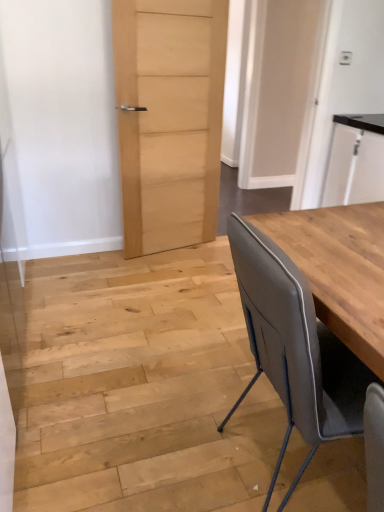
Locate an element on the screen. Image resolution: width=384 pixels, height=512 pixels. natural wood door at center, which is counted as the second door, starting from the right is located at coordinates (169, 119).

Locate an element on the screen. This screenshot has height=512, width=384. matte gray chair at right is located at coordinates (294, 348).

What do you see at coordinates (355, 160) in the screenshot? I see `white glossy cabinet at upper right` at bounding box center [355, 160].

This screenshot has width=384, height=512. I want to click on white glossy cabinet at upper right, so click(x=355, y=160).

Find the location of `natural wood door at center, which is counted as the second door, starting from the right`. natural wood door at center, which is counted as the second door, starting from the right is located at coordinates (169, 119).

What's the angular difference between white glossy cabinet at upper right and natural wood door at center, which is counted as the second door, starting from the right,'s facing directions?

The angle between the facing direction of white glossy cabinet at upper right and the facing direction of natural wood door at center, which is counted as the second door, starting from the right, is 102 degrees.

Where is `cabinetry below the natural wood door at center, which is counted as the second door, starting from the right (from a real-world perspective)`? The width and height of the screenshot is (384, 512). cabinetry below the natural wood door at center, which is counted as the second door, starting from the right (from a real-world perspective) is located at coordinates (355, 160).

Would you say white glossy cabinet at upper right is a long distance from natural wood door at center, which is counted as the second door, starting from the right?

white glossy cabinet at upper right is positioned a significant distance from natural wood door at center, which is counted as the second door, starting from the right.

Could you measure the distance between white glossy cabinet at upper right and natural wood door at center, the 1th door when ordered from left to right?

A distance of 1.18 meters exists between white glossy cabinet at upper right and natural wood door at center, the 1th door when ordered from left to right.

Can you tell me how much matte gray chair at right and matte wood door at center, marked as the first door in a right-to-left arrangement, differ in facing direction?

They differ by 86.3 degrees in their facing directions.

Is matte gray chair at right wider or thinner than matte wood door at center, marked as the first door in a right-to-left arrangement?

Considering their sizes, matte gray chair at right looks broader than matte wood door at center, marked as the first door in a right-to-left arrangement.

Is matte gray chair at right to the left of matte wood door at center, marked as the first door in a right-to-left arrangement, from the viewer's perspective?

Correct, you'll find matte gray chair at right to the left of matte wood door at center, marked as the first door in a right-to-left arrangement.

Is point (316, 351) closer or farther from the camera than point (248, 50)?

Point (316, 351) is positioned closer to the camera compared to point (248, 50).

Which of these two, white glossy cabinet at upper right or matte gray chair at right, is wider?

matte gray chair at right.

Can you confirm if white glossy cabinet at upper right is positioned to the right of matte gray chair at right?

Indeed, white glossy cabinet at upper right is positioned on the right side of matte gray chair at right.

Considering the positions of point (330, 191) and point (268, 347), is point (330, 191) closer or farther from the camera than point (268, 347)?

Point (330, 191) appears to be farther away from the viewer than point (268, 347).

From the image's perspective, would you say white glossy cabinet at upper right is shown under matte gray chair at right?

Actually, white glossy cabinet at upper right appears above matte gray chair at right in the image.

Would you say natural wood door at center, which is counted as the second door, starting from the right, is outside matte gray chair at right?

Yes, natural wood door at center, which is counted as the second door, starting from the right, is not within matte gray chair at right.

Where is `chair that is under the natural wood door at center, the 1th door when ordered from left to right (from a real-world perspective)`? Image resolution: width=384 pixels, height=512 pixels. chair that is under the natural wood door at center, the 1th door when ordered from left to right (from a real-world perspective) is located at coordinates (294, 348).

Is natural wood door at center, which is counted as the second door, starting from the right, oriented away from matte gray chair at right?

No, matte gray chair at right is not at the back of natural wood door at center, which is counted as the second door, starting from the right.

Which point is more forward, (145, 42) or (351, 366)?

The point (351, 366) is in front.

Considering the positions of objects natural wood door at center, the 1th door when ordered from left to right, and white glossy cabinet at upper right in the image provided, who is more to the right, natural wood door at center, the 1th door when ordered from left to right, or white glossy cabinet at upper right?

Positioned to the right is white glossy cabinet at upper right.

How different are the orientations of natural wood door at center, the 1th door when ordered from left to right, and white glossy cabinet at upper right in degrees?

102 degrees separate the facing orientations of natural wood door at center, the 1th door when ordered from left to right, and white glossy cabinet at upper right.

From a real-world perspective, is natural wood door at center, the 1th door when ordered from left to right, positioned above or below white glossy cabinet at upper right?

Clearly, from a real-world perspective, natural wood door at center, the 1th door when ordered from left to right, is above white glossy cabinet at upper right.

Consider the image. Which point is more forward, (206, 148) or (380, 150)?

Positioned in front is point (380, 150).

How far apart are matte wood door at center, marked as the first door in a right-to-left arrangement, and white glossy cabinet at upper right?

A distance of 1.30 meters exists between matte wood door at center, marked as the first door in a right-to-left arrangement, and white glossy cabinet at upper right.

Based on the photo, considering the sizes of matte wood door at center, the 2th door positioned from the left, and white glossy cabinet at upper right in the image, is matte wood door at center, the 2th door positioned from the left, bigger or smaller than white glossy cabinet at upper right?

In the image, matte wood door at center, the 2th door positioned from the left, appears to be smaller than white glossy cabinet at upper right.

From a real-world perspective, between matte wood door at center, the 2th door positioned from the left, and white glossy cabinet at upper right, who is vertically lower?

white glossy cabinet at upper right is physically lower.

From the image's perspective, is natural wood door at center, the 1th door when ordered from left to right, over matte wood door at center, the 2th door positioned from the left?

Incorrect, from the image's perspective, natural wood door at center, the 1th door when ordered from left to right, is lower than matte wood door at center, the 2th door positioned from the left.

Could you tell me if natural wood door at center, which is counted as the second door, starting from the right, is facing matte wood door at center, the 2th door positioned from the left?

No.

Considering the relative positions of natural wood door at center, the 1th door when ordered from left to right, and matte wood door at center, the 2th door positioned from the left, in the image provided, is natural wood door at center, the 1th door when ordered from left to right, to the right of matte wood door at center, the 2th door positioned from the left, from the viewer's perspective?

In fact, natural wood door at center, the 1th door when ordered from left to right, is to the left of matte wood door at center, the 2th door positioned from the left.

How many degrees apart are the facing directions of natural wood door at center, the 1th door when ordered from left to right, and matte wood door at center, the 2th door positioned from the left?

The angular difference between natural wood door at center, the 1th door when ordered from left to right, and matte wood door at center, the 2th door positioned from the left, is 11.7 degrees.

Where is `door in front of the white glossy cabinet at upper right`? The height and width of the screenshot is (512, 384). door in front of the white glossy cabinet at upper right is located at coordinates (169, 119).

At what (x,y) coordinates should I click in order to perform the action: click on chair that is on the left side of matte wood door at center, the 2th door positioned from the left. Please return your answer as a coordinate pair (x, y). Looking at the image, I should click on (294, 348).

Considering their positions, is white glossy cabinet at upper right positioned closer to matte wood door at center, the 2th door positioned from the left, than natural wood door at center, the 1th door when ordered from left to right?

white glossy cabinet at upper right.

Based on their spatial positions, is natural wood door at center, which is counted as the second door, starting from the right, or white glossy cabinet at upper right further from matte gray chair at right?

The object further to matte gray chair at right is white glossy cabinet at upper right.

From the image, which object appears to be farther from white glossy cabinet at upper right, natural wood door at center, which is counted as the second door, starting from the right, or matte wood door at center, the 2th door positioned from the left?

matte wood door at center, the 2th door positioned from the left.

Based on their spatial positions, is matte wood door at center, marked as the first door in a right-to-left arrangement, or matte gray chair at right further from natural wood door at center, the 1th door when ordered from left to right?

matte gray chair at right.

Based on their spatial positions, is natural wood door at center, the 1th door when ordered from left to right, or white glossy cabinet at upper right closer to matte wood door at center, the 2th door positioned from the left?

Among the two, white glossy cabinet at upper right is located nearer to matte wood door at center, the 2th door positioned from the left.

From the image, which object appears to be farther from natural wood door at center, the 1th door when ordered from left to right, white glossy cabinet at upper right or matte wood door at center, marked as the first door in a right-to-left arrangement?

The object further to natural wood door at center, the 1th door when ordered from left to right, is matte wood door at center, marked as the first door in a right-to-left arrangement.

Based on their spatial positions, is matte wood door at center, the 2th door positioned from the left, or natural wood door at center, the 1th door when ordered from left to right, further from white glossy cabinet at upper right?

matte wood door at center, the 2th door positioned from the left, lies further to white glossy cabinet at upper right than the other object.

Estimate the real-world distances between objects in this image. Which object is further from matte gray chair at right, natural wood door at center, the 1th door when ordered from left to right, or matte wood door at center, the 2th door positioned from the left?

matte wood door at center, the 2th door positioned from the left, is further to matte gray chair at right.

I want to click on door between matte gray chair at right and white glossy cabinet at upper right from front to back, so click(169, 119).

Locate an element on the screen. door between natural wood door at center, the 1th door when ordered from left to right, and white glossy cabinet at upper right, in the horizontal direction is located at coordinates (281, 90).

The width and height of the screenshot is (384, 512). I want to click on cabinetry between matte gray chair at right and matte wood door at center, marked as the first door in a right-to-left arrangement, along the z-axis, so click(355, 160).

The width and height of the screenshot is (384, 512). What are the coordinates of `door between matte gray chair at right and matte wood door at center, marked as the first door in a right-to-left arrangement, along the z-axis` in the screenshot? It's located at (169, 119).